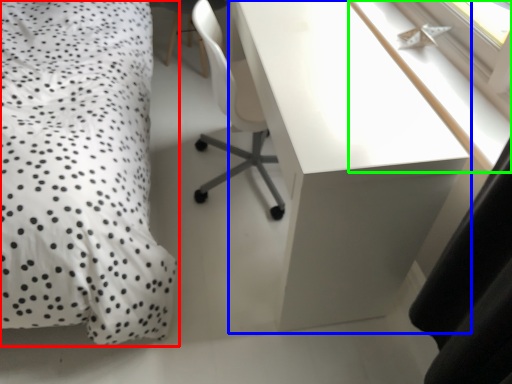
Question: Which is nearer to the bed (highlighted by a red box)? desk (highlighted by a blue box) or window sill (highlighted by a green box).

Choices:
 (A) desk
 (B) window sill

Answer: (A)